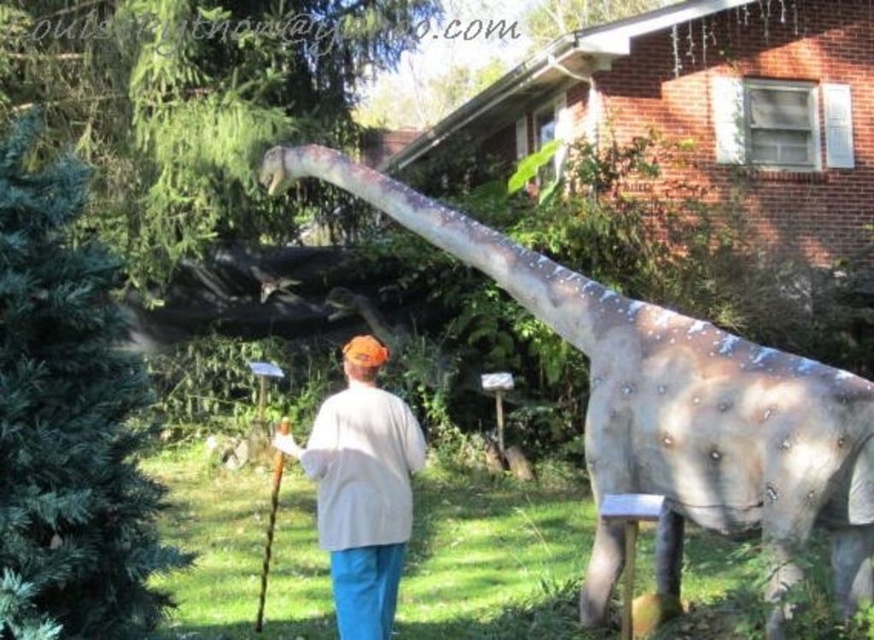
Locate an element on the screen. Image resolution: width=874 pixels, height=640 pixels. speckled gray dinosaur at center is located at coordinates (x=671, y=400).

Is speckled gray dinosaur at center bigger than white cotton shirt at center?

Correct, speckled gray dinosaur at center is larger in size than white cotton shirt at center.

Measure the distance between point [663,356] and camera.

They are 4.00 meters apart.

The height and width of the screenshot is (640, 874). I want to click on speckled gray dinosaur at center, so click(x=671, y=400).

Is the position of white cotton shirt at center less distant than that of wooden cane at center?

Yes, it is.

Between white cotton shirt at center and wooden cane at center, which one has less height?

Standing shorter between the two is wooden cane at center.

Measure the distance between point [373,465] and camera.

Point [373,465] and camera are 3.92 meters apart.

You are a GUI agent. You are given a task and a screenshot of the screen. Output one action in this format:
    pyautogui.click(x=<x>, y=<y>)
    Task: Click on the white cotton shirt at center
    The image size is (874, 640).
    Given the screenshot: What is the action you would take?
    click(362, 488)

Between point (274, 186) and point (269, 509), which one is positioned in front?

Positioned in front is point (274, 186).

What do you see at coordinates (671, 400) in the screenshot? I see `speckled gray dinosaur at center` at bounding box center [671, 400].

I want to click on speckled gray dinosaur at center, so click(671, 400).